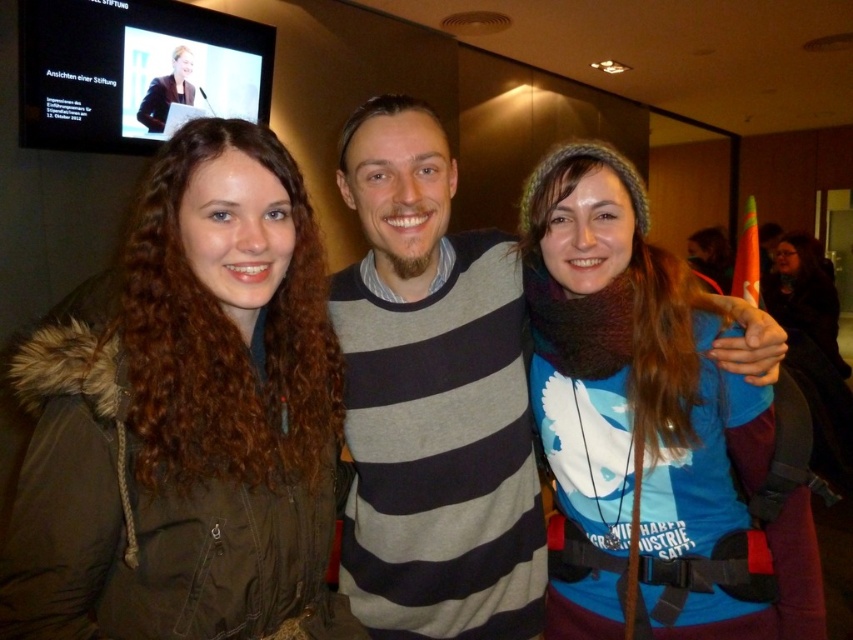
Question: Estimate the real-world distances between objects in this image. Which object is closer to the dark brown fur-lined jacket at center?

Choices:
 (A) matte black jacket at upper left
 (B) striped sweater at center

Answer: (B)

Question: Does dark brown fur-lined jacket at center appear on the left side of striped sweater at center?

Choices:
 (A) no
 (B) yes

Answer: (B)

Question: Is dark brown fur-lined jacket at center wider than striped sweater at center?

Choices:
 (A) no
 (B) yes

Answer: (A)

Question: Can you confirm if dark brown fur-lined jacket at center is positioned to the left of matte black jacket at upper left?

Choices:
 (A) no
 (B) yes

Answer: (A)

Question: Which of these objects is positioned closest to the matte black jacket at upper left?

Choices:
 (A) striped sweater at center
 (B) dark brown fur-lined jacket at center

Answer: (A)

Question: Which of the following is the closest to the observer?

Choices:
 (A) (751, 333)
 (B) (161, 90)
 (C) (33, 618)

Answer: (C)